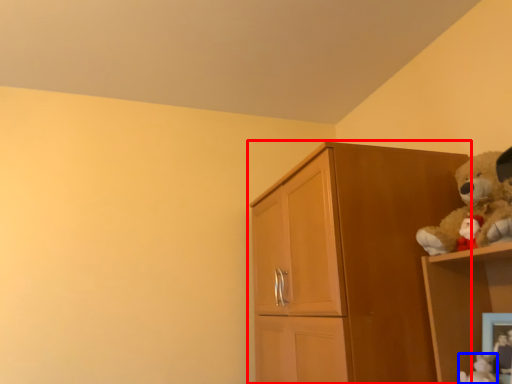
Question: Which point is further to the camera, cupboard (highlighted by a red box) or toy (highlighted by a blue box)?

Choices:
 (A) cupboard
 (B) toy

Answer: (B)